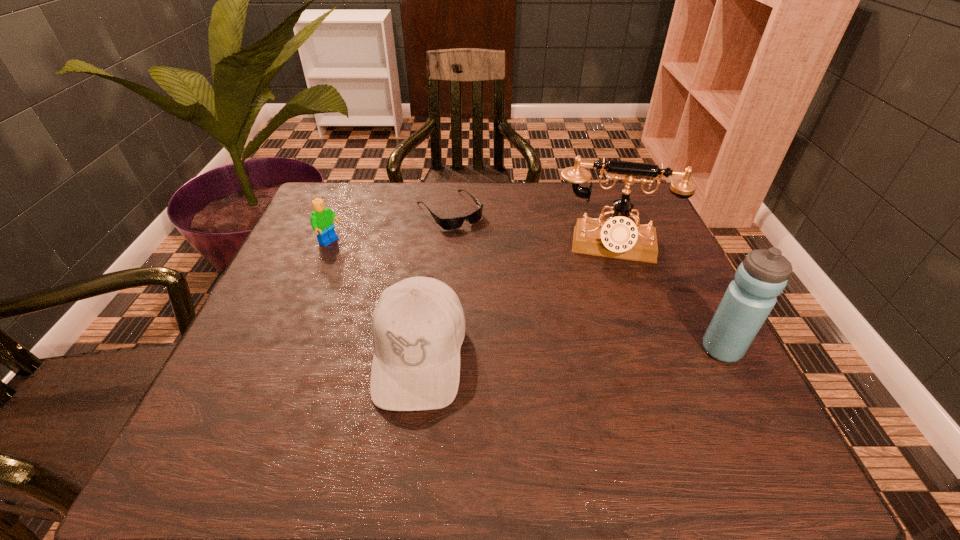
Locate an element on the screen. The width and height of the screenshot is (960, 540). vacant region located on the face of the leftmost object is located at coordinates (433, 294).

The image size is (960, 540). I want to click on vacant space situated on the face of the leftmost object, so click(429, 292).

Where is `vacant space located on the front-facing side of the shortest object`? The image size is (960, 540). vacant space located on the front-facing side of the shortest object is located at coordinates (490, 254).

Identify the location of free space located 0.110m on the front-facing side of the shortest object. (488, 252).

Locate an element on the screen. This screenshot has height=540, width=960. vacant region located 0.160m on the front-facing side of the shortest object is located at coordinates (498, 264).

Locate an element on the screen. This screenshot has width=960, height=540. telephone that is at the far edge is located at coordinates (619, 237).

At what (x,y) coordinates should I click in order to perform the action: click on sunglasses located at the far edge. Please return your answer as a coordinate pair (x, y). Looking at the image, I should click on pyautogui.click(x=455, y=223).

Identify the location of object located at the near edge. (418, 326).

The height and width of the screenshot is (540, 960). I want to click on object present at the left edge, so click(322, 218).

The height and width of the screenshot is (540, 960). I want to click on water bottle at the right edge, so click(x=762, y=276).